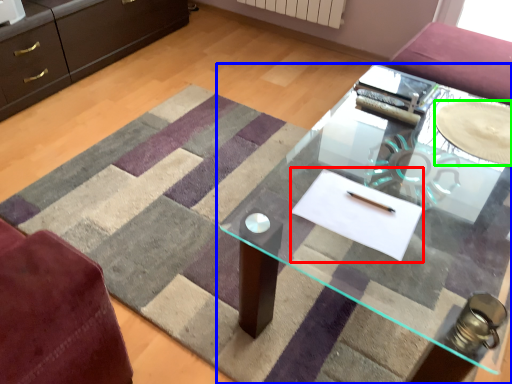
Question: Which object is the closest to the flat (highlighted by a red box)? Choose among these: table (highlighted by a blue box) or glass plate (highlighted by a green box).

Choices:
 (A) table
 (B) glass plate

Answer: (B)